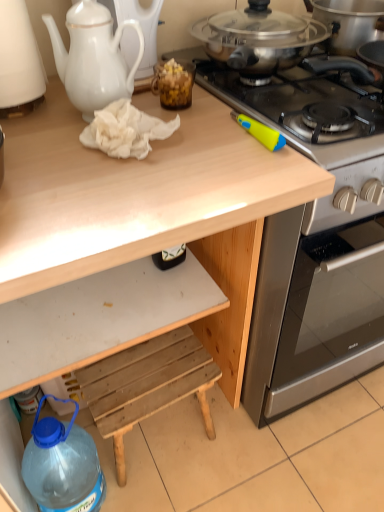
Where is `free location in front of wooden step stool at lower center`? free location in front of wooden step stool at lower center is located at coordinates (171, 490).